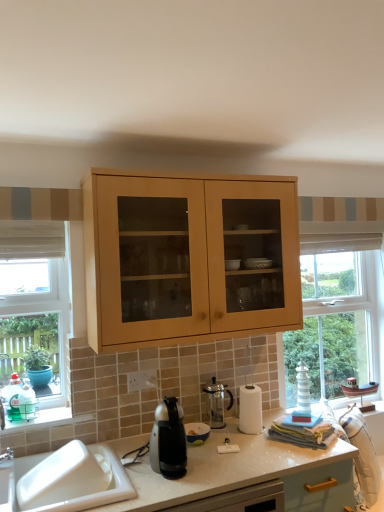
Question: From the image's perspective, is matte black coffee maker at center, the second appliance viewed from the back, beneath clear glass coffee pot at center, which ranks as the first appliance in back-to-front order?

Choices:
 (A) yes
 (B) no

Answer: (A)

Question: Is matte black coffee maker at center, arranged as the first appliance when viewed from the front, smaller than clear glass coffee pot at center, which ranks as the first appliance in back-to-front order?

Choices:
 (A) no
 (B) yes

Answer: (B)

Question: Is the position of matte black coffee maker at center, arranged as the first appliance when viewed from the front, less distant than that of clear glass coffee pot at center, acting as the 2th appliance starting from the front?

Choices:
 (A) yes
 (B) no

Answer: (A)

Question: Is matte black coffee maker at center, arranged as the first appliance when viewed from the front, at the left side of clear glass coffee pot at center, which ranks as the first appliance in back-to-front order?

Choices:
 (A) yes
 (B) no

Answer: (A)

Question: From the image's perspective, is matte black coffee maker at center, the second appliance viewed from the back, on top of clear glass coffee pot at center, which ranks as the first appliance in back-to-front order?

Choices:
 (A) no
 (B) yes

Answer: (A)

Question: Based on their sizes in the image, would you say white glossy sink at lower left is bigger or smaller than satin black coffee maker at center?

Choices:
 (A) big
 (B) small

Answer: (A)

Question: Based on their positions, is white glossy sink at lower left located to the left or right of satin black coffee maker at center?

Choices:
 (A) left
 (B) right

Answer: (A)

Question: From a real-world perspective, relative to satin black coffee maker at center, is white glossy sink at lower left vertically above or below?

Choices:
 (A) below
 (B) above

Answer: (A)

Question: Which is correct: white glossy sink at lower left is inside satin black coffee maker at center, or outside of it?

Choices:
 (A) inside
 (B) outside

Answer: (B)

Question: In the image, is white glossy sink at lower left on the left side or the right side of matte black coffee maker at center, the second appliance viewed from the back?

Choices:
 (A) left
 (B) right

Answer: (A)

Question: In terms of width, does white glossy sink at lower left look wider or thinner when compared to matte black coffee maker at center, the second appliance viewed from the back?

Choices:
 (A) thin
 (B) wide

Answer: (B)

Question: In terms of height, does white glossy sink at lower left look taller or shorter compared to matte black coffee maker at center, the second appliance viewed from the back?

Choices:
 (A) tall
 (B) short

Answer: (A)

Question: Is white glossy sink at lower left inside the boundaries of matte black coffee maker at center, arranged as the first appliance when viewed from the front, or outside?

Choices:
 (A) outside
 (B) inside

Answer: (A)

Question: Considering the positions of satin black coffee maker at center and white glossy sink at lower left in the image, is satin black coffee maker at center bigger or smaller than white glossy sink at lower left?

Choices:
 (A) big
 (B) small

Answer: (B)

Question: From the image's perspective, is satin black coffee maker at center above or below white glossy sink at lower left?

Choices:
 (A) above
 (B) below

Answer: (A)